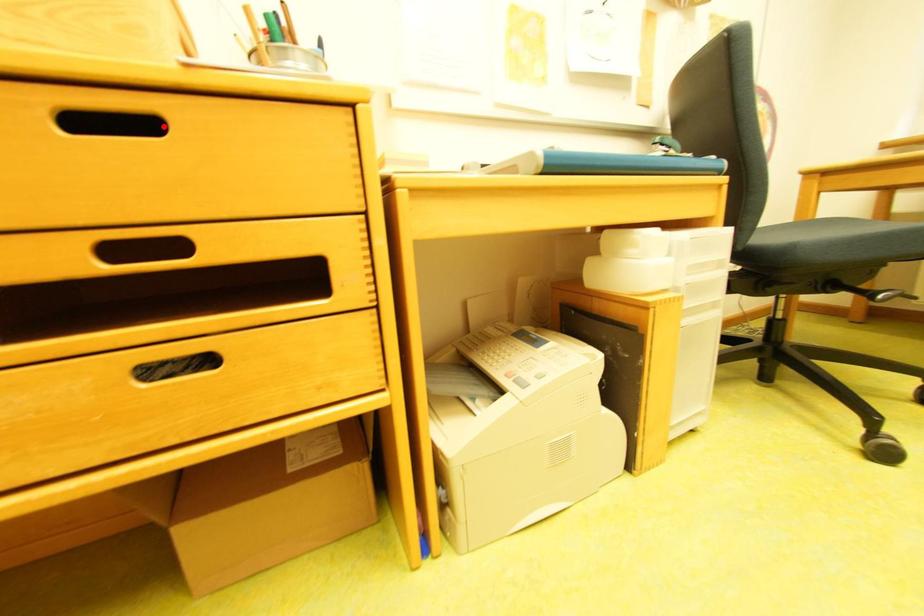
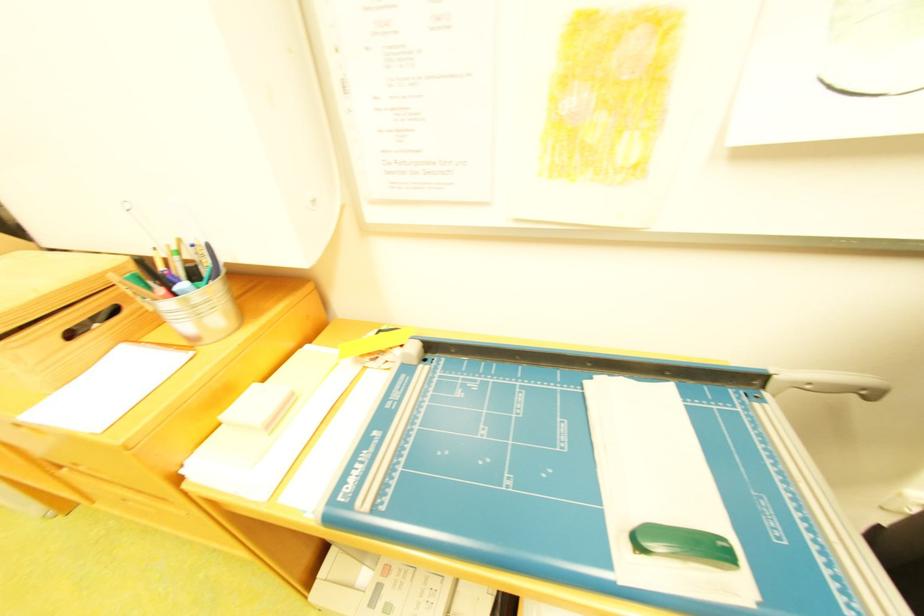
Question: I am providing you with two images of the same scene from different viewpoints. A red point is marked on the first image. At the location where the point appears in image 1, is it still visible in image 2?

Choices:
 (A) Yes
 (B) No

Answer: (B)